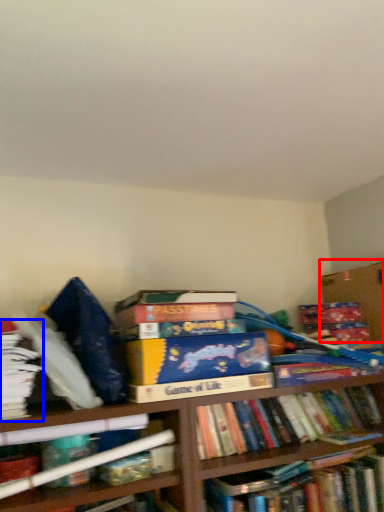
Question: Which object appears farthest to the camera in this image, cardboard box (highlighted by a red box) or book (highlighted by a blue box)?

Choices:
 (A) cardboard box
 (B) book

Answer: (A)